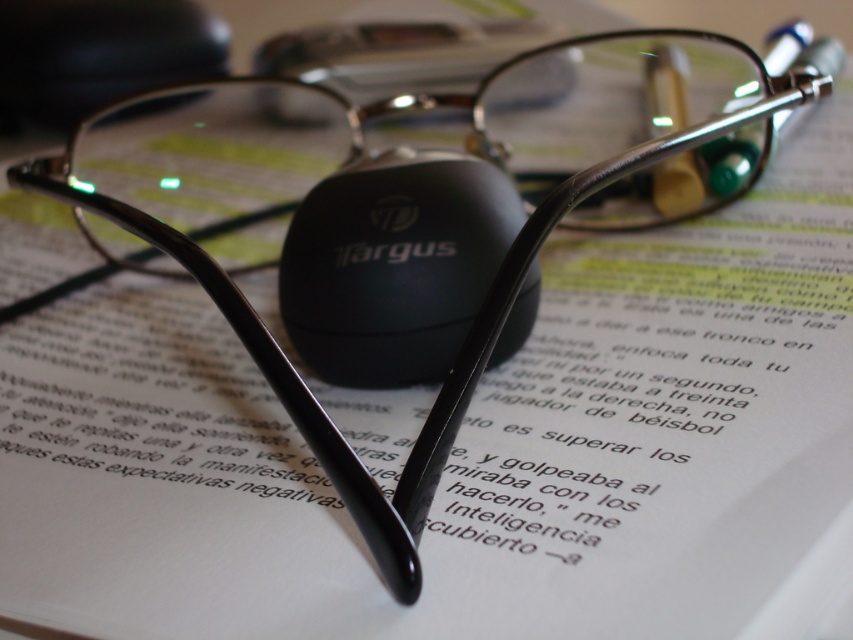
Which of these two, matte black mouse at center or black matte mouse at upper center, stands shorter?

black matte mouse at upper center

Looking at this image, can you confirm if matte black mouse at center is thinner than black matte mouse at upper center?

Yes, matte black mouse at center is thinner than black matte mouse at upper center.

What do you see at coordinates (393, 264) in the screenshot?
I see `matte black mouse at center` at bounding box center [393, 264].

Where is `matte black mouse at center`? The width and height of the screenshot is (853, 640). matte black mouse at center is located at coordinates [393, 264].